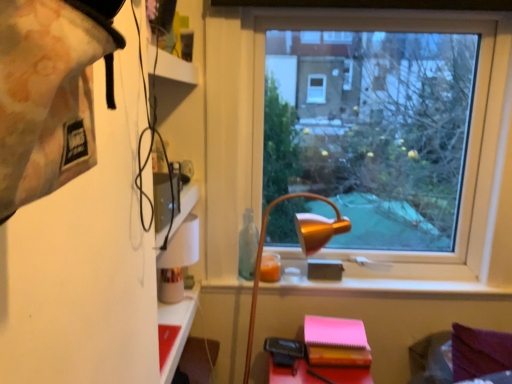
Describe the element at coordinates (178, 325) in the screenshot. I see `matte red table at lower left` at that location.

This screenshot has width=512, height=384. What do you see at coordinates (336, 342) in the screenshot?
I see `pink matte notebook at lower right` at bounding box center [336, 342].

Describe the element at coordinates (383, 125) in the screenshot. I see `transparent glass window at center` at that location.

In order to click on gold metallic lamp at center in this screenshot , I will do `click(302, 249)`.

Is pink matte notebook at lower right further to the viewer compared to gold metallic lamp at center?

Yes.

Is point (369, 358) closer or farther from the camera than point (254, 315)?

Point (369, 358) appears to be closer to the viewer than point (254, 315).

Is pink matte notebook at lower right wider than gold metallic lamp at center?

Yes.

Based on the photo, is gold metallic lamp at center at the back of pink matte notebook at lower right?

Correct, pink matte notebook at lower right is looking away from gold metallic lamp at center.

Is pink matte notebook at lower right behind matte red table at lower left?

That is True.

Based on their positions, is pink matte notebook at lower right located to the left or right of matte red table at lower left?

Based on their positions, pink matte notebook at lower right is located to the right of matte red table at lower left.

Locate an element on the screen. This screenshot has width=512, height=384. table located below the pink matte notebook at lower right (from the image's perspective) is located at coordinates (178, 325).

How many degrees apart are the facing directions of pink matte notebook at lower right and matte red table at lower left?

91.3 degrees.

Does matte red table at lower left have a lesser height compared to gold metallic lamp at center?

Yes.

Is matte red table at lower left oriented away from gold metallic lamp at center?

matte red table at lower left does not have its back to gold metallic lamp at center.

Which object is closer to the camera, matte red table at lower left or gold metallic lamp at center?

gold metallic lamp at center is in front.

Who is bigger, matte red table at lower left or gold metallic lamp at center?

Bigger between the two is gold metallic lamp at center.

Is matte red table at lower left taller or shorter than transparent glass window at center?

Considering their sizes, matte red table at lower left has less height than transparent glass window at center.

Does matte red table at lower left have a lesser width compared to transparent glass window at center?

Incorrect, the width of matte red table at lower left is not less than that of transparent glass window at center.

Is the depth of matte red table at lower left less than that of transparent glass window at center?

Yes, it is in front of transparent glass window at center.

You are a GUI agent. You are given a task and a screenshot of the screen. Output one action in this format:
    pyautogui.click(x=<x>, y=<y>)
    Task: Click on the table on the left of transparent glass window at center
    Image resolution: width=512 pixels, height=384 pixels.
    Given the screenshot: What is the action you would take?
    pyautogui.click(x=178, y=325)

Consider the image. Considering the relative positions of matte red table at lower left and pink matte notebook at lower right in the image provided, is matte red table at lower left behind pink matte notebook at lower right?

No, matte red table at lower left is closer to the camera.

From the image's perspective, is matte red table at lower left on pink matte notebook at lower right?

Incorrect, from the image's perspective, matte red table at lower left is lower than pink matte notebook at lower right.

Which point is more forward, [161,304] or [315,326]?

Point [161,304]

Could you tell me if matte red table at lower left is turned towards pink matte notebook at lower right?

Yes, matte red table at lower left is oriented towards pink matte notebook at lower right.

From the image's perspective, is gold metallic lamp at center positioned above or below pink matte notebook at lower right?

Based on their image positions, gold metallic lamp at center is located above pink matte notebook at lower right.

Considering the sizes of objects gold metallic lamp at center and pink matte notebook at lower right in the image provided, who is bigger, gold metallic lamp at center or pink matte notebook at lower right?

Bigger between the two is gold metallic lamp at center.

Is gold metallic lamp at center turned away from pink matte notebook at lower right?

That's right, gold metallic lamp at center is facing away from pink matte notebook at lower right.

Which of these two, gold metallic lamp at center or pink matte notebook at lower right, stands taller?

Standing taller between the two is gold metallic lamp at center.

From the image's perspective, does gold metallic lamp at center appear higher than transparent glass window at center?

No.

Can you confirm if gold metallic lamp at center is wider than transparent glass window at center?

Indeed, gold metallic lamp at center has a greater width compared to transparent glass window at center.

Is gold metallic lamp at center far away from transparent glass window at center?

gold metallic lamp at center is far away from transparent glass window at center.

Find the location of a particular element. The width and height of the screenshot is (512, 384). notebook on the right of gold metallic lamp at center is located at coordinates (336, 342).

At what (x,y) coordinates should I click in order to perform the action: click on notebook that appears behind the matte red table at lower left. Please return your answer as a coordinate pair (x, y). This screenshot has height=384, width=512. Looking at the image, I should click on (336, 342).

Estimate the real-world distances between objects in this image. Which object is further from pink matte notebook at lower right, transparent glass window at center or matte red table at lower left?

transparent glass window at center.

Looking at the image, which one is located further to transparent glass window at center, pink matte notebook at lower right or matte red table at lower left?

Among the two, matte red table at lower left is located further to transparent glass window at center.

Based on their spatial positions, is matte red table at lower left or pink matte notebook at lower right further from gold metallic lamp at center?

Among the two, matte red table at lower left is located further to gold metallic lamp at center.

When comparing their distances from pink matte notebook at lower right, does matte red table at lower left or gold metallic lamp at center seem closer?

The object closer to pink matte notebook at lower right is gold metallic lamp at center.

Estimate the real-world distances between objects in this image. Which object is further from transparent glass window at center, matte red table at lower left or pink matte notebook at lower right?

matte red table at lower left is positioned further to the anchor transparent glass window at center.

Based on their spatial positions, is pink matte notebook at lower right or gold metallic lamp at center further from matte red table at lower left?

pink matte notebook at lower right is further to matte red table at lower left.

When comparing their distances from gold metallic lamp at center, does pink matte notebook at lower right or transparent glass window at center seem further?

transparent glass window at center lies further to gold metallic lamp at center than the other object.

Based on their spatial positions, is transparent glass window at center or pink matte notebook at lower right further from matte red table at lower left?

Among the two, transparent glass window at center is located further to matte red table at lower left.

Where is `lamp between transparent glass window at center and pink matte notebook at lower right in the up-down direction`? This screenshot has width=512, height=384. lamp between transparent glass window at center and pink matte notebook at lower right in the up-down direction is located at coordinates (302, 249).

This screenshot has height=384, width=512. What are the coordinates of `notebook between transparent glass window at center and matte red table at lower left in the up-down direction` in the screenshot? It's located at (336, 342).

What are the coordinates of `lamp between transparent glass window at center and matte red table at lower left in the up-down direction` in the screenshot? It's located at (302, 249).

You are a GUI agent. You are given a task and a screenshot of the screen. Output one action in this format:
    pyautogui.click(x=<x>, y=<y>)
    Task: Click on the lamp situated between matte red table at lower left and pink matte notebook at lower right from left to right
    The width and height of the screenshot is (512, 384).
    Given the screenshot: What is the action you would take?
    (x=302, y=249)